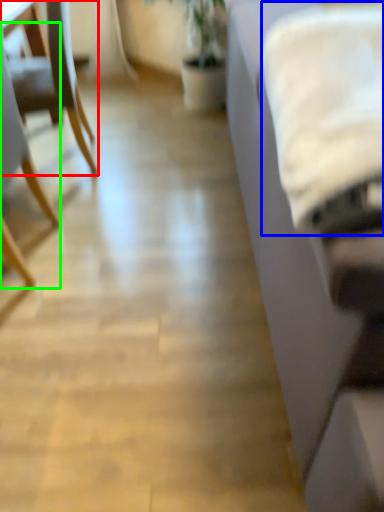
Question: Which object is the closest to the chair (highlighted by a red box)? Choose among these: sheet (highlighted by a blue box) or chair (highlighted by a green box).

Choices:
 (A) sheet
 (B) chair

Answer: (B)